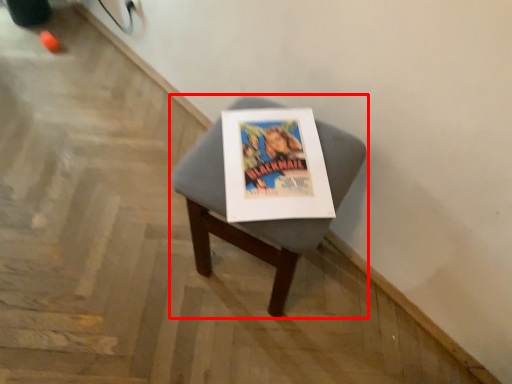
Question: From the image's perspective, what is the correct spatial positioning of furniture (annotated by the red box) in reference to magazine?

Choices:
 (A) below
 (B) above

Answer: (A)